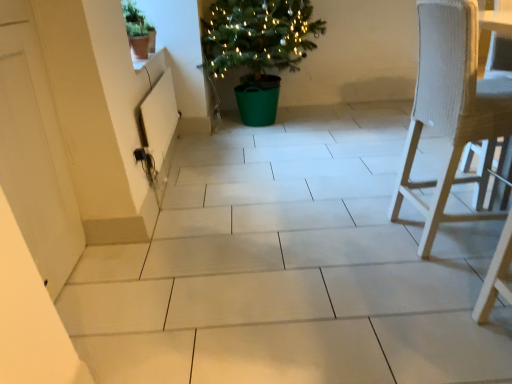
Question: From the image's perspective, relative to white woven chair at right, is green matte pot at upper left, which ranks as the 1th houseplant in left-to-right order, above or below?

Choices:
 (A) below
 (B) above

Answer: (B)

Question: In the image, is green matte pot at upper left, arranged as the second houseplant when viewed from the right, on the left side or the right side of white woven chair at right?

Choices:
 (A) right
 (B) left

Answer: (B)

Question: Which object is the farthest from the white woven chair at right?

Choices:
 (A) white matte door at left
 (B) green plastic potted plant at center, which is the first houseplant from right to left
 (C) green matte pot at upper left, which ranks as the 1th houseplant in left-to-right order

Answer: (B)

Question: Considering the real-world distances, which object is closest to the white matte door at left?

Choices:
 (A) white woven chair at right
 (B) green matte pot at upper left, which is the first houseplant in front-to-back order
 (C) green plastic potted plant at center, which ranks as the 2th houseplant in left-to-right order

Answer: (B)